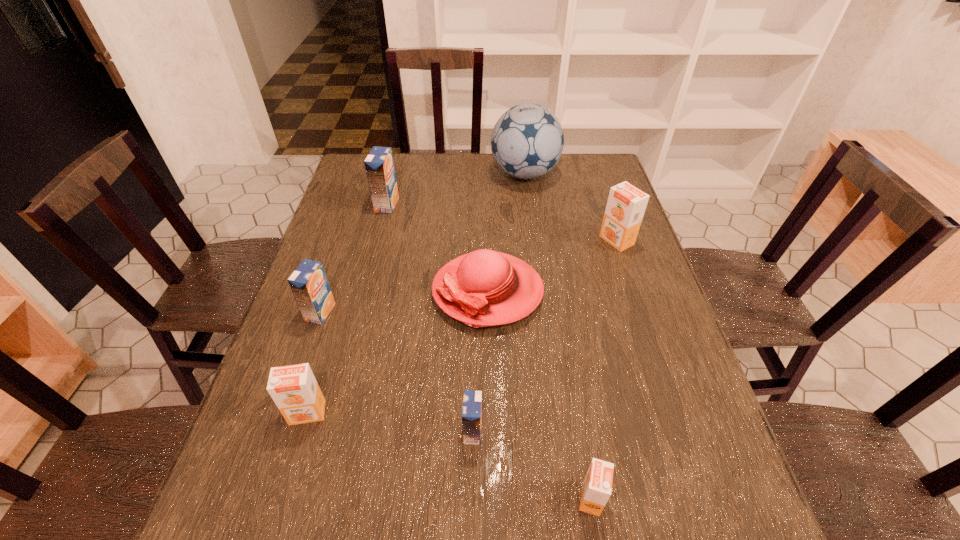
The image size is (960, 540). Find the location of `free space located on the back of the fourth nearest orange juice`. free space located on the back of the fourth nearest orange juice is located at coordinates (333, 275).

You are a GUI agent. You are given a task and a screenshot of the screen. Output one action in this format:
    pyautogui.click(x=<x>, y=<y>)
    Task: Click on the free space located 0.280m on the right of the second farthest orange orange juice
    
    Given the screenshot: What is the action you would take?
    pyautogui.click(x=463, y=413)

This screenshot has height=540, width=960. In order to click on vacant area situated 0.170m at the front of the red hat with a bow in this screenshot , I will do `click(367, 291)`.

At what (x,y) coordinates should I click in order to perform the action: click on vacant space located 0.200m at the front of the red hat with a bow. Please return your answer as a coordinate pair (x, y). This screenshot has height=540, width=960. Looking at the image, I should click on (355, 291).

Locate an element on the screen. This screenshot has height=540, width=960. vacant space located 0.220m at the front of the red hat with a bow is located at coordinates (347, 291).

Where is `vacant space located 0.300m on the left of the smallest blue orange_juice`? The image size is (960, 540). vacant space located 0.300m on the left of the smallest blue orange_juice is located at coordinates (312, 431).

At what (x,y) coordinates should I click in order to perform the action: click on vacant space situated 0.120m on the back of the nearest orange juice. Please return your answer as a coordinate pair (x, y). Looking at the image, I should click on (578, 420).

At what (x,y) coordinates should I click in order to perform the action: click on object present at the far edge. Please return your answer as a coordinate pair (x, y). Image resolution: width=960 pixels, height=540 pixels. Looking at the image, I should click on (527, 141).

Locate an element on the screen. The width and height of the screenshot is (960, 540). object at the near edge is located at coordinates (596, 490).

I want to click on object that is at the right edge, so 626,204.